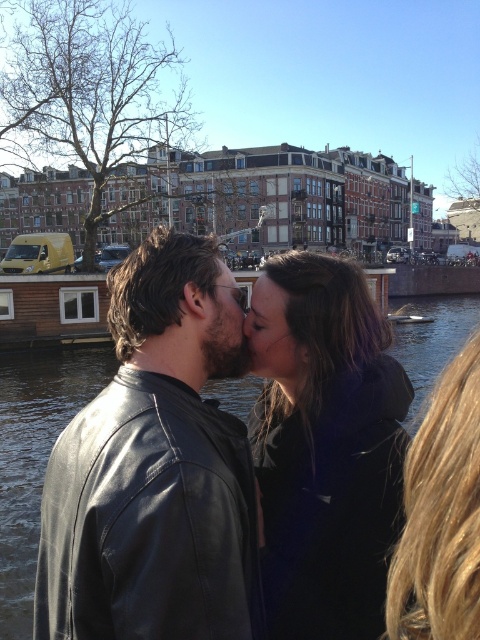
Question: Among these points, which one is nearest to the camera?

Choices:
 (A) (453, 579)
 (B) (126, 452)
 (C) (331, 396)
 (D) (268, 307)

Answer: (A)

Question: Is dark brown leather jacket at center bigger than clear water at center?

Choices:
 (A) yes
 (B) no

Answer: (B)

Question: From the image, what is the correct spatial relationship of dark brown leather jacket at center in relation to blonde hair at lower right?

Choices:
 (A) above
 (B) below

Answer: (B)

Question: Does black leather jacket at center appear on the left side of blonde hair at lower right?

Choices:
 (A) no
 (B) yes

Answer: (B)

Question: Which of the following is the closest to the observer?

Choices:
 (A) (275, 304)
 (B) (387, 477)
 (C) (3, 522)
 (D) (447, 477)

Answer: (D)

Question: Considering the real-world distances, which object is farthest from the matte black forehead at center?

Choices:
 (A) blonde hair at lower right
 (B) clear water at center

Answer: (B)